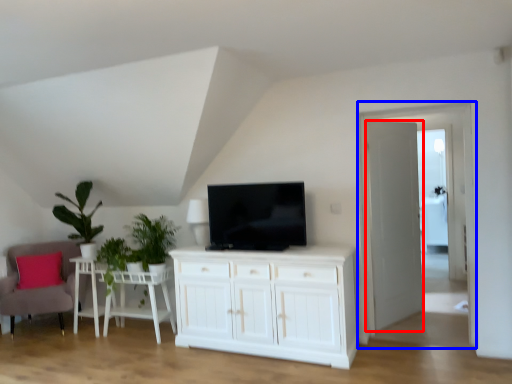
Question: Which object appears farthest to the camera in this image, door (highlighted by a red box) or glass door (highlighted by a blue box)?

Choices:
 (A) door
 (B) glass door

Answer: (A)